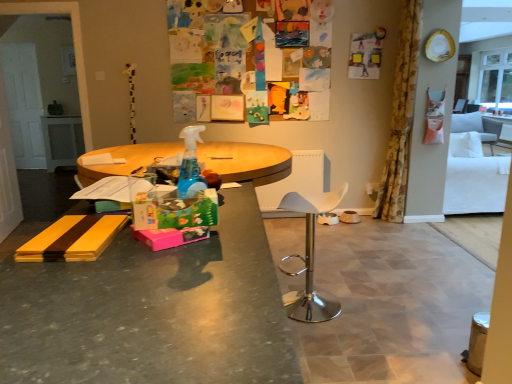
The image size is (512, 384). Find the location of `clear glass window at upper right`. clear glass window at upper right is located at coordinates (496, 80).

Identify the location of white fabric armchair at right, placed as the first armchair when sorted from front to back. (478, 127).

Find the location of a particular element. white fabric couch at right is located at coordinates (474, 168).

In order to face silver metallic bowl at center, the first bowl from the left, should I rotate leftwards or rightwards?

A 9.607 degree turn to the right will do.

Measure the distance between point (303, 304) and camera.

Point (303, 304) is 8.56 feet from camera.

You are a GUI agent. You are given a task and a screenshot of the screen. Output one action in this format:
    pyautogui.click(x=<x>, y=<y>)
    Task: Click on the clear glass window at upper right
    The height and width of the screenshot is (384, 512).
    Given the screenshot: What is the action you would take?
    pyautogui.click(x=496, y=80)

Does white fabric armchair at right, placed as the first armchair when sorted from front to back, come behind white fabric armchair at right, which ranks as the second armchair in left-to-right order?

No, white fabric armchair at right, placed as the first armchair when sorted from front to back, is closer to the camera.

Is white fabric armchair at right, acting as the second armchair starting from the back, turned away from white fabric armchair at right, the 1th armchair from the right?

Yes, white fabric armchair at right, the 1th armchair from the right, is at the back of white fabric armchair at right, acting as the second armchair starting from the back.

Considering the relative sizes of white fabric armchair at right, the second armchair when ordered from top to bottom, and white fabric armchair at right, which ranks as the second armchair in left-to-right order, in the image provided, is white fabric armchair at right, the second armchair when ordered from top to bottom, bigger than white fabric armchair at right, which ranks as the second armchair in left-to-right order,?

Yes, white fabric armchair at right, the second armchair when ordered from top to bottom, is bigger than white fabric armchair at right, which ranks as the second armchair in left-to-right order.

Between white fabric armchair at right, placed as the first armchair when sorted from front to back, and white fabric armchair at right, the 1th armchair from the right, which one has larger width?

white fabric armchair at right, placed as the first armchair when sorted from front to back.

From a real-world perspective, is white fabric armchair at right, the second armchair when ordered from top to bottom, located beneath matte gray desk at center?

Yes, from a real-world perspective, white fabric armchair at right, the second armchair when ordered from top to bottom, is under matte gray desk at center.

Can you confirm if white fabric armchair at right, the 2th armchair viewed from the right, is taller than matte gray desk at center?

No, white fabric armchair at right, the 2th armchair viewed from the right, is not taller than matte gray desk at center.

Is white fabric armchair at right, acting as the second armchair starting from the back, oriented towards matte gray desk at center?

No, white fabric armchair at right, acting as the second armchair starting from the back, is not aimed at matte gray desk at center.

Visually, is white fabric armchair at right, the second armchair when ordered from top to bottom, positioned to the left or to the right of matte gray desk at center?

In the image, white fabric armchair at right, the second armchair when ordered from top to bottom, appears on the right side of matte gray desk at center.

Can you confirm if white fabric couch at right is taller than matte gray desk at center?

No, white fabric couch at right is not taller than matte gray desk at center.

Considering the sizes of objects white fabric couch at right and matte gray desk at center in the image provided, who is wider, white fabric couch at right or matte gray desk at center?

With larger width is white fabric couch at right.

Considering the sizes of objects white fabric couch at right and matte gray desk at center in the image provided, who is bigger, white fabric couch at right or matte gray desk at center?

With larger size is white fabric couch at right.

Can you tell me how much silver metallic bowl at center, the first bowl from the left, and white fabric armchair at right, the 1th armchair from the right, differ in facing direction?

The facing directions of silver metallic bowl at center, the first bowl from the left, and white fabric armchair at right, the 1th armchair from the right, are 90.3 degrees apart.

Measure the distance from silver metallic bowl at center, which is the 2th bowl from right to left, to white fabric armchair at right, which ranks as the 2th armchair in bottom-to-top order.

The distance of silver metallic bowl at center, which is the 2th bowl from right to left, from white fabric armchair at right, which ranks as the 2th armchair in bottom-to-top order, is 3.38 meters.

Can you confirm if silver metallic bowl at center, which is the 2th bowl from right to left, is smaller than white fabric armchair at right, placed as the 1th armchair when sorted from back to front?

Yes.

From the image's perspective, is silver metallic bowl at center, which is the 2th bowl from right to left, above or below white fabric armchair at right, the second armchair positioned from the front?

Clearly, from the image's perspective, silver metallic bowl at center, which is the 2th bowl from right to left, is below white fabric armchair at right, the second armchair positioned from the front.

What's the angular difference between white fabric couch at right and floral fabric curtain at right's facing directions?

They differ by 178 degrees in their facing directions.

From a real-world perspective, between white fabric couch at right and floral fabric curtain at right, who is vertically lower?

white fabric couch at right.

Could you tell me if white fabric couch at right is facing floral fabric curtain at right?

No.

Could floral fabric curtain at right be considered to be inside white fabric couch at right?

No.

Is silver metallic bowl at center, the first bowl from the left, bigger or smaller than white plastic chair at center?

Considering their sizes, silver metallic bowl at center, the first bowl from the left, takes up less space than white plastic chair at center.

Could you measure the distance between silver metallic bowl at center, which is the 2th bowl from right to left, and white plastic chair at center?

The distance of silver metallic bowl at center, which is the 2th bowl from right to left, from white plastic chair at center is 1.57 meters.

From the image's perspective, between silver metallic bowl at center, the first bowl from the left, and white plastic chair at center, which one is located above?

silver metallic bowl at center, the first bowl from the left, is shown above in the image.

Can you confirm if silver metallic bowl at center, the first bowl from the left, is positioned to the right of white plastic chair at center?

Yes, silver metallic bowl at center, the first bowl from the left, is to the right of white plastic chair at center.

Considering the sizes of objects white fabric couch at right and brown ceramic bowl at center, the second bowl in the left-to-right sequence, in the image provided, who is bigger, white fabric couch at right or brown ceramic bowl at center, the second bowl in the left-to-right sequence,?

white fabric couch at right.

From a real-world perspective, is white fabric couch at right positioned over brown ceramic bowl at center, the 1th bowl when ordered from right to left, based on gravity?

Correct, in the physical world, white fabric couch at right is higher than brown ceramic bowl at center, the 1th bowl when ordered from right to left.

From the image's perspective, is white fabric couch at right below brown ceramic bowl at center, the 1th bowl when ordered from right to left?

No, from the image's perspective, white fabric couch at right is not beneath brown ceramic bowl at center, the 1th bowl when ordered from right to left.

Which is more to the right, white fabric couch at right or brown ceramic bowl at center, the second bowl in the left-to-right sequence?

white fabric couch at right.

Identify the location of armchair in front of the white fabric armchair at right, which ranks as the 2th armchair in bottom-to-top order. The image size is (512, 384). (478, 127).

In order to click on armchair that is the 1st object to the right of the matte gray desk at center, starting at the anchor in this screenshot , I will do `click(478, 127)`.

Estimate the real-world distances between objects in this image. Which object is closer to white fabric couch at right, floral fabric curtain at right or white fabric armchair at right, the 1th armchair from the right?

Among the two, floral fabric curtain at right is located nearer to white fabric couch at right.

Consider the image. Estimate the real-world distances between objects in this image. Which object is further from floral fabric curtain at right, silver metallic bowl at center, which is the 2th bowl from right to left, or brown ceramic bowl at center, the second bowl in the left-to-right sequence?

The object further to floral fabric curtain at right is silver metallic bowl at center, which is the 2th bowl from right to left.

Estimate the real-world distances between objects in this image. Which object is closer to white fabric armchair at right, the second armchair when ordered from top to bottom, matte gray desk at center or white fabric couch at right?

white fabric couch at right.

Considering their positions, is silver metallic bowl at center, which is the 2th bowl from right to left, positioned closer to white fabric armchair at right, the second armchair positioned from the front, than white fabric couch at right?

Among the two, white fabric couch at right is located nearer to white fabric armchair at right, the second armchair positioned from the front.

From the image, which object appears to be nearer to silver metallic bowl at center, the first bowl from the left, matte gray desk at center or floral fabric curtain at right?

floral fabric curtain at right is positioned closer to the anchor silver metallic bowl at center, the first bowl from the left.

Looking at the image, which one is located further to silver metallic bowl at center, which is the 2th bowl from right to left, white fabric couch at right or brown ceramic bowl at center, the 1th bowl when ordered from right to left?

white fabric couch at right.

Considering their positions, is silver metallic bowl at center, which is the 2th bowl from right to left, positioned closer to white fabric couch at right than brown ceramic bowl at center, the second bowl in the left-to-right sequence?

brown ceramic bowl at center, the second bowl in the left-to-right sequence, is closer to white fabric couch at right.

Which object lies nearer to the anchor point white fabric couch at right, clear glass window at upper right or silver metallic bowl at center, which is the 2th bowl from right to left?

silver metallic bowl at center, which is the 2th bowl from right to left, lies closer to white fabric couch at right than the other object.

The image size is (512, 384). Identify the location of chair between matte gray desk at center and floral fabric curtain at right from front to back. coord(310,258).

Find the location of a particular element. This screenshot has height=384, width=512. armchair between floral fabric curtain at right and clear glass window at upper right from front to back is located at coordinates (478, 127).

Identify the location of studio couch between white plastic chair at center and silver metallic bowl at center, the first bowl from the left, in the front-back direction. The width and height of the screenshot is (512, 384). (474, 168).

Where is `window screen between white fabric armchair at right, acting as the second armchair starting from the back, and white fabric armchair at right, the second armchair positioned from the front, along the z-axis`? This screenshot has width=512, height=384. window screen between white fabric armchair at right, acting as the second armchair starting from the back, and white fabric armchair at right, the second armchair positioned from the front, along the z-axis is located at coordinates (496, 80).